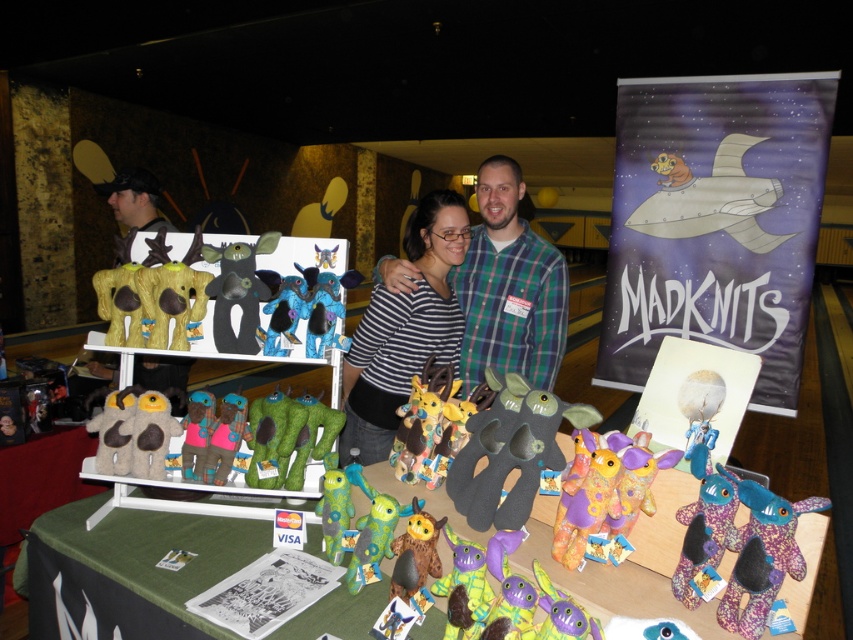
Question: Is plaid flannel shirt at center bigger than fuzzy brown plush at center?

Choices:
 (A) yes
 (B) no

Answer: (A)

Question: Does plaid flannel shirt at center lie in front of fuzzy brown plush at center?

Choices:
 (A) no
 (B) yes

Answer: (A)

Question: Can you confirm if plaid flannel shirt at center is wider than fluffy yellow plush at center?

Choices:
 (A) yes
 (B) no

Answer: (A)

Question: Which of the following is the farthest from the observer?

Choices:
 (A) striped fabric shirt at center
 (B) fuzzy fabric plush at center
 (C) fluffy yellow plush at center
 (D) matte black plush toy at center

Answer: (D)

Question: Which object appears farthest from the camera in this image?

Choices:
 (A) striped fabric shirt at center
 (B) dark gray felt toy at center
 (C) fluffy yellow plush at center
 (D) fuzzy brown plush at center

Answer: (D)

Question: Which of the following is the farthest from the observer?

Choices:
 (A) (160, 404)
 (B) (413, 397)
 (C) (212, 428)
 (D) (235, 417)

Answer: (D)